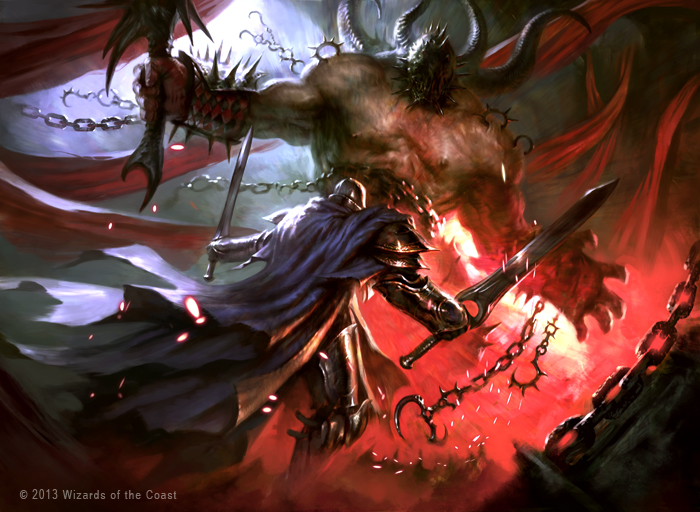
Locate an element on the screen. art is located at coordinates (602, 287).